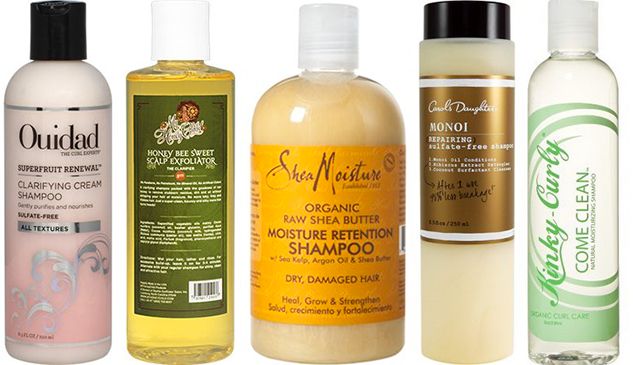
The height and width of the screenshot is (365, 633). Find the location of `product bottles`. product bottles is located at coordinates (584, 197), (467, 229), (348, 219), (180, 220), (66, 224).